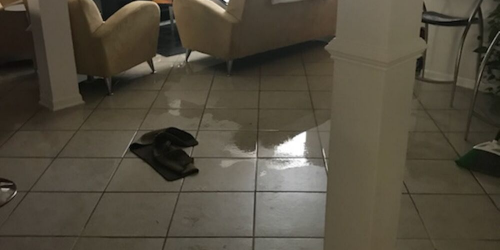
Image resolution: width=500 pixels, height=250 pixels. In order to click on right double seater  couch in this screenshot , I will do `click(234, 29)`.